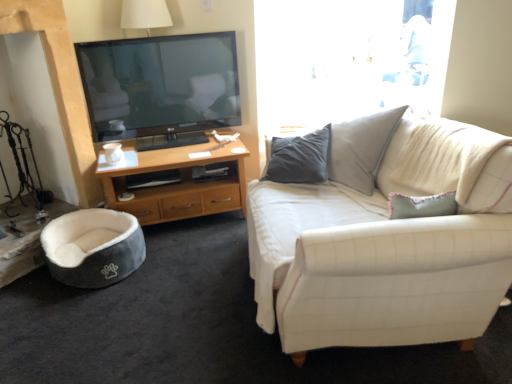
Where is `vacant area that is in front of velvet grey bean bag at lower left`? The width and height of the screenshot is (512, 384). vacant area that is in front of velvet grey bean bag at lower left is located at coordinates (76, 318).